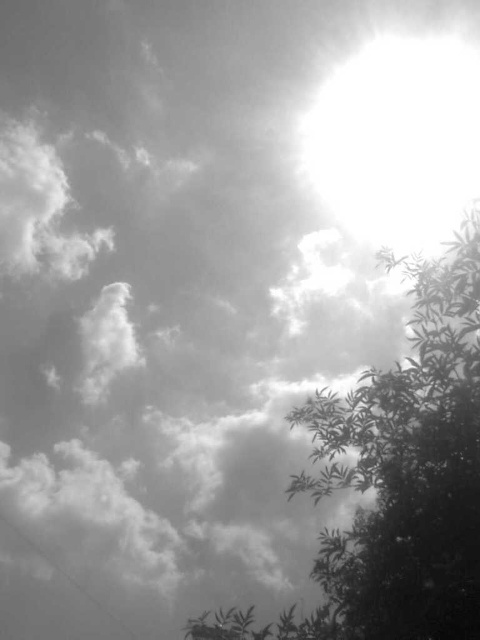
The image size is (480, 640). What do you see at coordinates (397, 477) in the screenshot?
I see `silhouetted leafy branch at lower right` at bounding box center [397, 477].

Is silhouetted leafy branch at lower right to the left of bright white sun at upper right from the viewer's perspective?

Indeed, silhouetted leafy branch at lower right is positioned on the left side of bright white sun at upper right.

What do you see at coordinates (397, 477) in the screenshot? Image resolution: width=480 pixels, height=640 pixels. I see `silhouetted leafy branch at lower right` at bounding box center [397, 477].

In order to click on silhouetted leafy branch at lower right in this screenshot , I will do `click(397, 477)`.